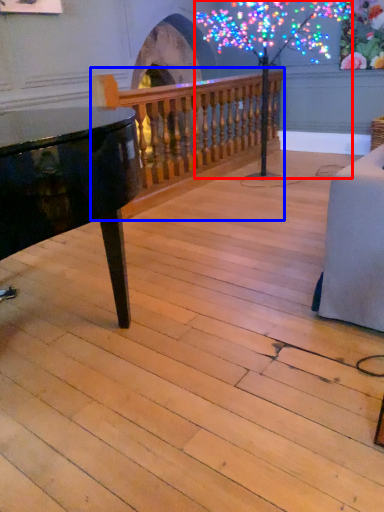
Question: Which object appears farthest to the camera in this image, tree (highlighted by a red box) or rail (highlighted by a blue box)?

Choices:
 (A) tree
 (B) rail

Answer: (B)